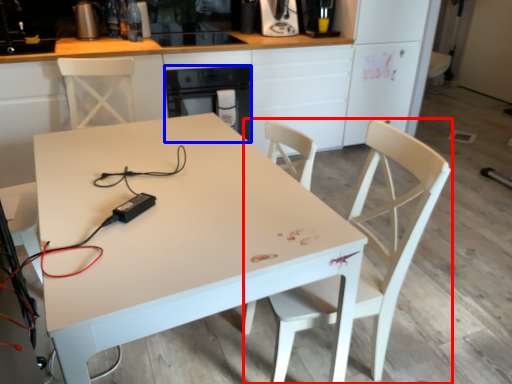
Question: Which of the following is the closest to the observer, chair (highlighted by a red box) or oven (highlighted by a blue box)?

Choices:
 (A) chair
 (B) oven

Answer: (A)